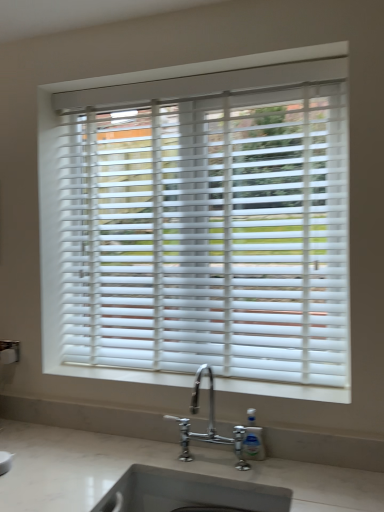
The height and width of the screenshot is (512, 384). In order to click on free location above white matte blinds at center (from a real-world perspective) in this screenshot , I will do `click(197, 80)`.